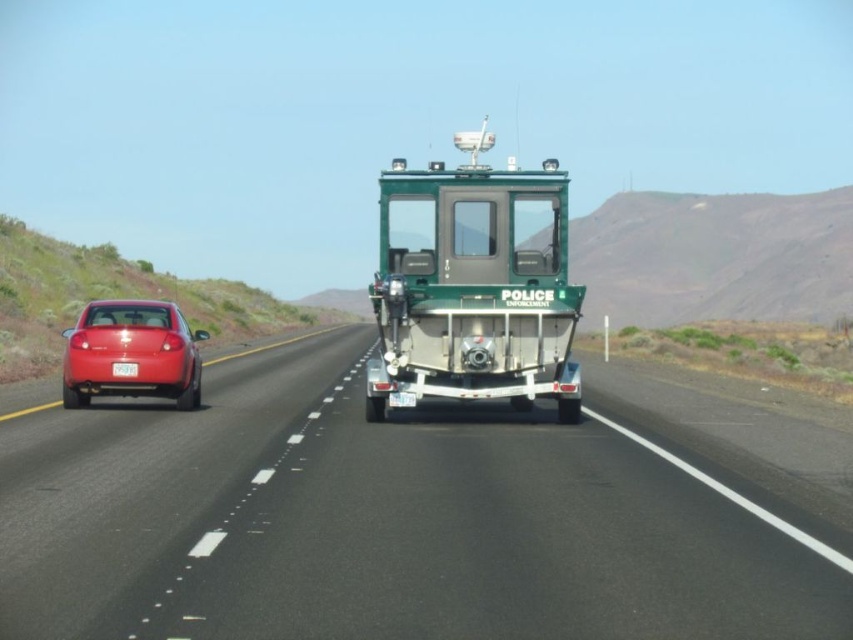
You are a drone operator trying to capture aerial footage of two points on the highway. The first point is labeled as point (x=242, y=442) and the second is point (x=112, y=372). Based on the scene, which point should you focus on first to ensure it appears larger in your footage?

Point (x=242, y=442) should be focused on first because it is closer to the viewer, making it appear larger in the footage compared to point (x=112, y=372).

You are driving a car and see the black asphalt road at center and the white plastic license plate at center. Which one is closer to you?

The black asphalt road at center is closer to you because it is in front of the white plastic license plate at center.

You are a driver approaching the green matte police boat at center and the white plastic license plate at center on the highway. Which object is higher from the ground?

The green matte police boat at center is taller than the white plastic license plate at center, so the green matte police boat at center is higher from the ground.